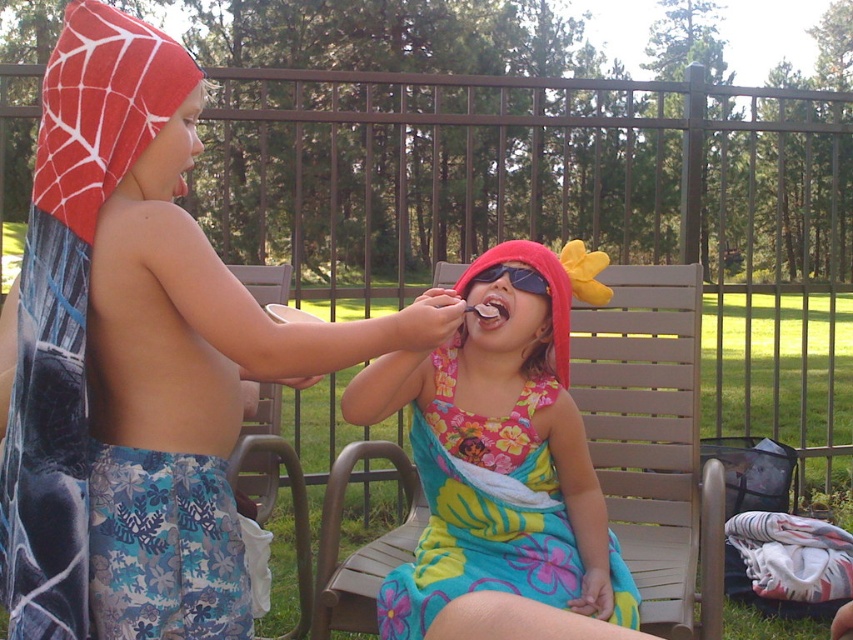
In the scene shown: What is located at the coordinates point (137, 365)?

The floral fabric dress at center is located at point (137, 365).

You are a photographer trying to capture a closeup of the black plastic goggles at upper center without including the floral print fabric dress at center in the frame. Is this possible given their positions?

The floral print fabric dress at center is closer to the viewer than the black plastic goggles at upper center, so it would block the view of the goggles. Therefore, capturing a closeup of the black plastic goggles at upper center without including the floral print fabric dress at center is not possible.